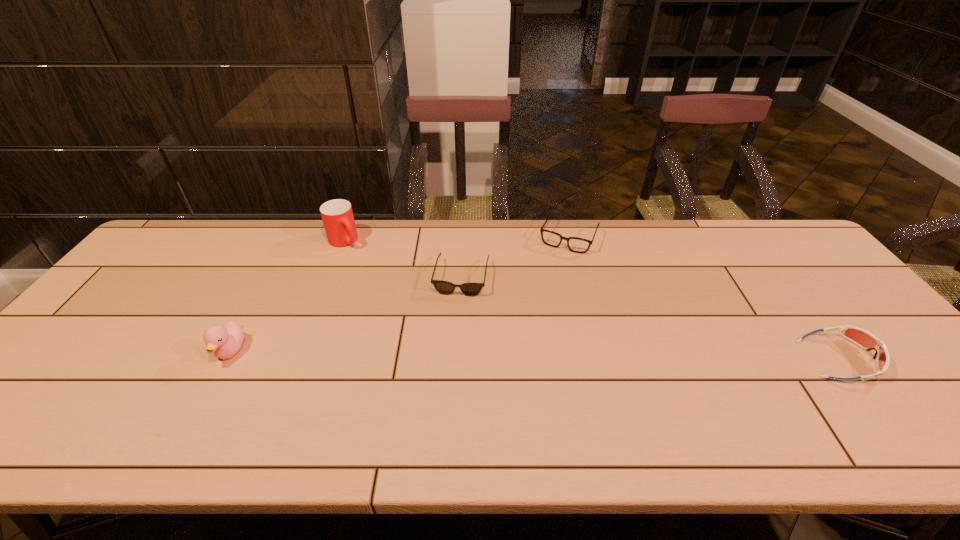
I want to click on free space on the desktop that is between the duckling and the goggles and is positioned on the front-facing side of the spectacles, so click(511, 355).

The height and width of the screenshot is (540, 960). I want to click on vacant space on the desktop that is between the fourth shortest object and the rightmost object and is positioned on the front lenses of the third object from right to left, so click(446, 354).

Identify the location of free spot on the desktop that is between the leftmost object and the goggles and is positioned on the side of the cup with the handle. The image size is (960, 540). (459, 354).